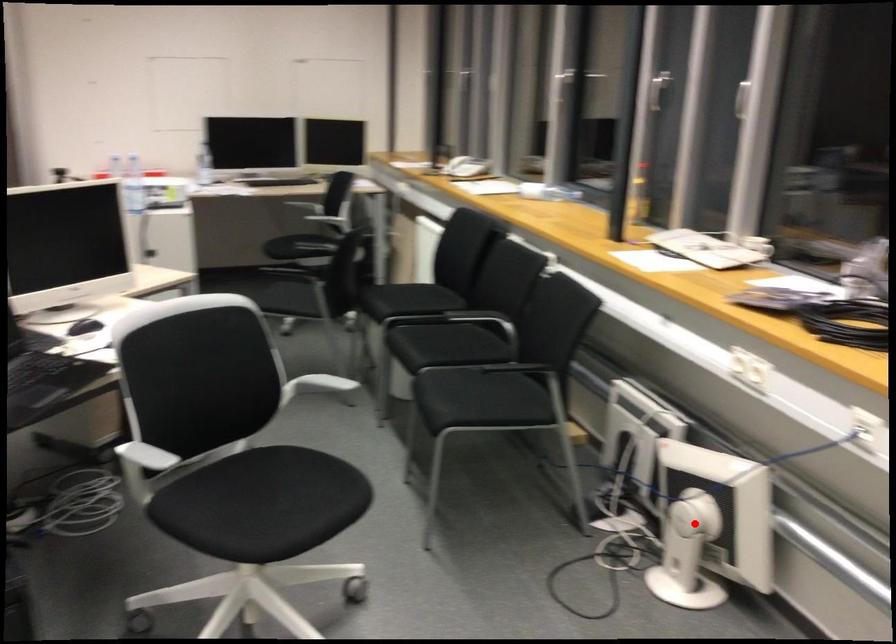
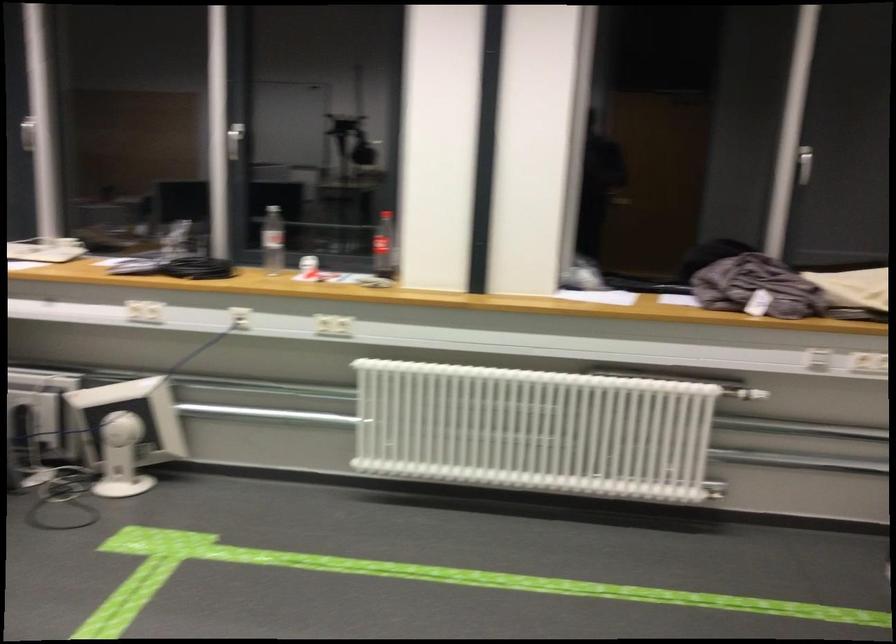
Find the pixel in the second image that matches the highlighted location in the first image.

(126, 431)